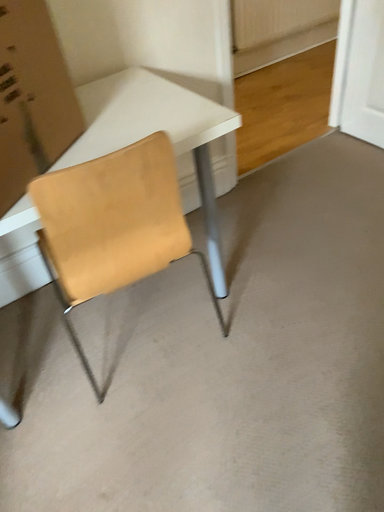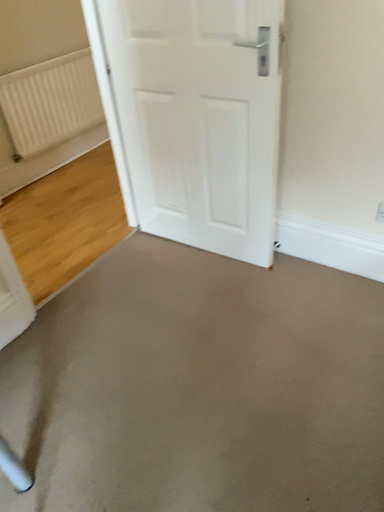
Question: How did the camera likely rotate when shooting the video?

Choices:
 (A) rotated downward
 (B) rotated upward

Answer: (B)